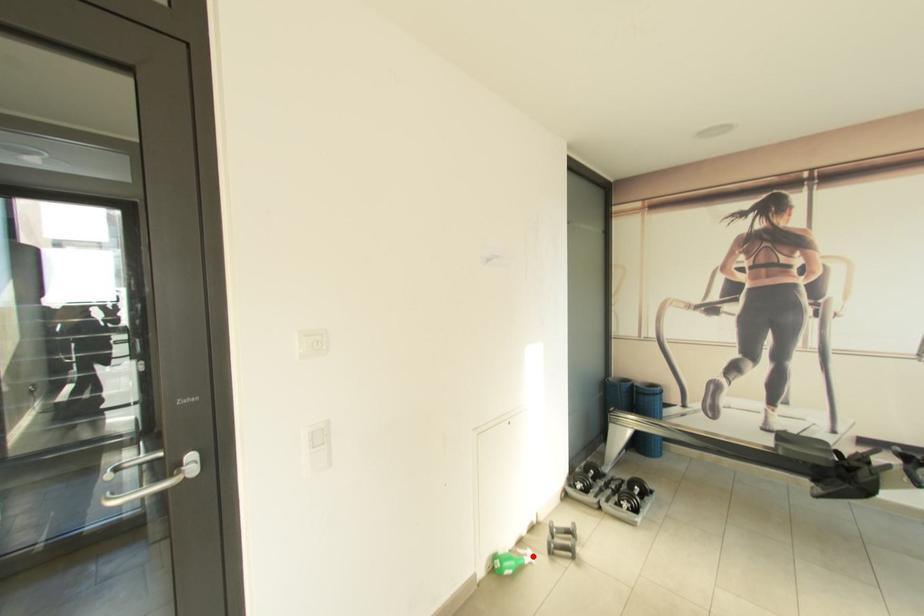
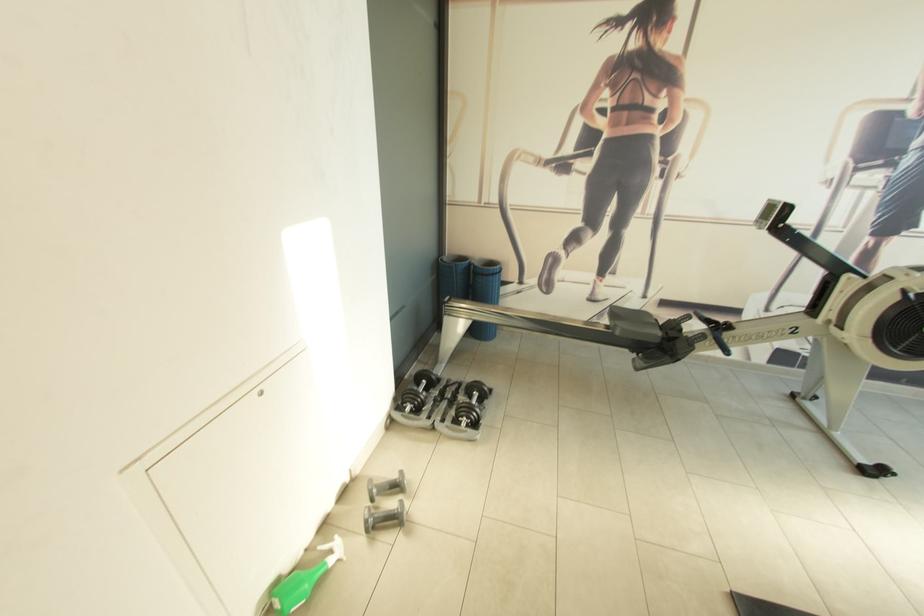
The point at the highlighted location is marked in the first image. Where is the corresponding point in the second image?

(339, 551)